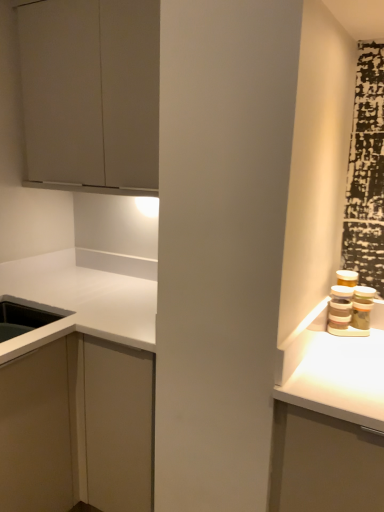
Identify the location of matte gray cabinet at upper left, marked as the first cabinetry in a top-to-bottom arrangement. The height and width of the screenshot is (512, 384). (91, 93).

Describe the element at coordinates (91, 93) in the screenshot. I see `matte gray cabinet at upper left, marked as the first cabinetry in a top-to-bottom arrangement` at that location.

The height and width of the screenshot is (512, 384). What do you see at coordinates (77, 389) in the screenshot? I see `white matte cabinet at lower left, arranged as the 2th cabinetry when viewed from the top` at bounding box center [77, 389].

Where is `white matte cabinet at lower left, the 1th cabinetry positioned from the bottom`? white matte cabinet at lower left, the 1th cabinetry positioned from the bottom is located at coordinates tap(77, 389).

Measure the distance between white matte cabinet at lower left, arranged as the 2th cabinetry when viewed from the top, and camera.

white matte cabinet at lower left, arranged as the 2th cabinetry when viewed from the top, is 4.19 feet away from camera.

How much space does white matte cabinet at lower left, arranged as the 2th cabinetry when viewed from the top, occupy vertically?

white matte cabinet at lower left, arranged as the 2th cabinetry when viewed from the top, is 1.03 meters in height.

The width and height of the screenshot is (384, 512). In order to click on matte gray cabinet at upper left, marked as the first cabinetry in a top-to-bottom arrangement in this screenshot , I will do `click(91, 93)`.

Between matte gray cabinet at upper left, the second cabinetry ordered from the bottom, and white matte cabinet at lower left, arranged as the 2th cabinetry when viewed from the top, which one appears on the right side from the viewer's perspective?

matte gray cabinet at upper left, the second cabinetry ordered from the bottom, is more to the right.

In the image, is matte gray cabinet at upper left, the second cabinetry ordered from the bottom, positioned in front of or behind white matte cabinet at lower left, arranged as the 2th cabinetry when viewed from the top?

In the image, matte gray cabinet at upper left, the second cabinetry ordered from the bottom, appears behind white matte cabinet at lower left, arranged as the 2th cabinetry when viewed from the top.

Considering the points (155, 135) and (65, 310), which point is in front, point (155, 135) or point (65, 310)?

Positioned in front is point (155, 135).

From the image's perspective, does matte gray cabinet at upper left, marked as the first cabinetry in a top-to-bottom arrangement, appear lower than white matte cabinet at lower left, the 1th cabinetry positioned from the bottom?

Actually, matte gray cabinet at upper left, marked as the first cabinetry in a top-to-bottom arrangement, appears above white matte cabinet at lower left, the 1th cabinetry positioned from the bottom, in the image.

From a real-world perspective, is matte gray cabinet at upper left, the second cabinetry ordered from the bottom, over white matte cabinet at lower left, arranged as the 2th cabinetry when viewed from the top?

Indeed, from a real-world perspective, matte gray cabinet at upper left, the second cabinetry ordered from the bottom, stands above white matte cabinet at lower left, arranged as the 2th cabinetry when viewed from the top.

In the scene shown: Is matte gray cabinet at upper left, the second cabinetry ordered from the bottom, wider or thinner than white matte cabinet at lower left, arranged as the 2th cabinetry when viewed from the top?

In the image, matte gray cabinet at upper left, the second cabinetry ordered from the bottom, appears to be more narrow than white matte cabinet at lower left, arranged as the 2th cabinetry when viewed from the top.

Considering the sizes of objects matte gray cabinet at upper left, marked as the first cabinetry in a top-to-bottom arrangement, and white matte cabinet at lower left, the 1th cabinetry positioned from the bottom, in the image provided, who is shorter, matte gray cabinet at upper left, marked as the first cabinetry in a top-to-bottom arrangement, or white matte cabinet at lower left, the 1th cabinetry positioned from the bottom,?

matte gray cabinet at upper left, marked as the first cabinetry in a top-to-bottom arrangement, is shorter.

Who is smaller, matte gray cabinet at upper left, marked as the first cabinetry in a top-to-bottom arrangement, or white matte cabinet at lower left, the 1th cabinetry positioned from the bottom?

matte gray cabinet at upper left, marked as the first cabinetry in a top-to-bottom arrangement.

Is matte gray cabinet at upper left, marked as the first cabinetry in a top-to-bottom arrangement, inside or outside of white matte cabinet at lower left, arranged as the 2th cabinetry when viewed from the top?

The correct answer is: outside.

Is matte gray cabinet at upper left, marked as the first cabinetry in a top-to-bottom arrangement, positioned with its back to white matte cabinet at lower left, arranged as the 2th cabinetry when viewed from the top?

No, matte gray cabinet at upper left, marked as the first cabinetry in a top-to-bottom arrangement, is not facing the opposite direction of white matte cabinet at lower left, arranged as the 2th cabinetry when viewed from the top.

Can you tell me how much matte gray cabinet at upper left, marked as the first cabinetry in a top-to-bottom arrangement, and white matte cabinet at lower left, arranged as the 2th cabinetry when viewed from the top, differ in facing direction?

There is a 0.0279-degree angle between the facing directions of matte gray cabinet at upper left, marked as the first cabinetry in a top-to-bottom arrangement, and white matte cabinet at lower left, arranged as the 2th cabinetry when viewed from the top.

Measure the distance from matte gray cabinet at upper left, marked as the first cabinetry in a top-to-bottom arrangement, to white matte cabinet at lower left, the 1th cabinetry positioned from the bottom.

A distance of 30.34 inches exists between matte gray cabinet at upper left, marked as the first cabinetry in a top-to-bottom arrangement, and white matte cabinet at lower left, the 1th cabinetry positioned from the bottom.

Where is `cabinetry to the left of matte gray cabinet at upper left, marked as the first cabinetry in a top-to-bottom arrangement`? This screenshot has height=512, width=384. cabinetry to the left of matte gray cabinet at upper left, marked as the first cabinetry in a top-to-bottom arrangement is located at coordinates (77, 389).

In the image, is white matte cabinet at lower left, the 1th cabinetry positioned from the bottom, on the left side or the right side of matte gray cabinet at upper left, marked as the first cabinetry in a top-to-bottom arrangement?

In the image, white matte cabinet at lower left, the 1th cabinetry positioned from the bottom, appears on the left side of matte gray cabinet at upper left, marked as the first cabinetry in a top-to-bottom arrangement.

Which is in front, white matte cabinet at lower left, the 1th cabinetry positioned from the bottom, or matte gray cabinet at upper left, marked as the first cabinetry in a top-to-bottom arrangement?

white matte cabinet at lower left, the 1th cabinetry positioned from the bottom, is more forward.

Is point (52, 259) in front of point (26, 53)?

No.

From the image's perspective, between white matte cabinet at lower left, arranged as the 2th cabinetry when viewed from the top, and matte gray cabinet at upper left, marked as the first cabinetry in a top-to-bottom arrangement, who is located below?

white matte cabinet at lower left, arranged as the 2th cabinetry when viewed from the top.

From a real-world perspective, is white matte cabinet at lower left, arranged as the 2th cabinetry when viewed from the top, physically below matte gray cabinet at upper left, marked as the first cabinetry in a top-to-bottom arrangement?

Correct, in the physical world, white matte cabinet at lower left, arranged as the 2th cabinetry when viewed from the top, is lower than matte gray cabinet at upper left, marked as the first cabinetry in a top-to-bottom arrangement.

Considering the sizes of white matte cabinet at lower left, the 1th cabinetry positioned from the bottom, and matte gray cabinet at upper left, the second cabinetry ordered from the bottom, in the image, is white matte cabinet at lower left, the 1th cabinetry positioned from the bottom, wider or thinner than matte gray cabinet at upper left, the second cabinetry ordered from the bottom,?

In the image, white matte cabinet at lower left, the 1th cabinetry positioned from the bottom, appears to be wider than matte gray cabinet at upper left, the second cabinetry ordered from the bottom.

Considering the relative sizes of white matte cabinet at lower left, arranged as the 2th cabinetry when viewed from the top, and matte gray cabinet at upper left, marked as the first cabinetry in a top-to-bottom arrangement, in the image provided, is white matte cabinet at lower left, arranged as the 2th cabinetry when viewed from the top, taller than matte gray cabinet at upper left, marked as the first cabinetry in a top-to-bottom arrangement,?

Yes, white matte cabinet at lower left, arranged as the 2th cabinetry when viewed from the top, is taller than matte gray cabinet at upper left, marked as the first cabinetry in a top-to-bottom arrangement.

Does white matte cabinet at lower left, arranged as the 2th cabinetry when viewed from the top, have a smaller size compared to matte gray cabinet at upper left, the second cabinetry ordered from the bottom?

Actually, white matte cabinet at lower left, arranged as the 2th cabinetry when viewed from the top, might be larger than matte gray cabinet at upper left, the second cabinetry ordered from the bottom.

Do you think white matte cabinet at lower left, the 1th cabinetry positioned from the bottom, is within matte gray cabinet at upper left, the second cabinetry ordered from the bottom, or outside of it?

white matte cabinet at lower left, the 1th cabinetry positioned from the bottom, lies outside matte gray cabinet at upper left, the second cabinetry ordered from the bottom.

Can you see white matte cabinet at lower left, the 1th cabinetry positioned from the bottom, touching matte gray cabinet at upper left, the second cabinetry ordered from the bottom?

No, white matte cabinet at lower left, the 1th cabinetry positioned from the bottom, is not beside matte gray cabinet at upper left, the second cabinetry ordered from the bottom.

Is white matte cabinet at lower left, the 1th cabinetry positioned from the bottom, positioned with its back to matte gray cabinet at upper left, marked as the first cabinetry in a top-to-bottom arrangement?

That's not correct — white matte cabinet at lower left, the 1th cabinetry positioned from the bottom, is not looking away from matte gray cabinet at upper left, marked as the first cabinetry in a top-to-bottom arrangement.

Can you tell me how much white matte cabinet at lower left, arranged as the 2th cabinetry when viewed from the top, and matte gray cabinet at upper left, the second cabinetry ordered from the bottom, differ in facing direction?

The facing directions of white matte cabinet at lower left, arranged as the 2th cabinetry when viewed from the top, and matte gray cabinet at upper left, the second cabinetry ordered from the bottom, are 0.0279 degrees apart.

Image resolution: width=384 pixels, height=512 pixels. Identify the location of cabinetry on the right of white matte cabinet at lower left, arranged as the 2th cabinetry when viewed from the top. (91, 93).

Find the location of a particular element. Image resolution: width=384 pixels, height=512 pixels. cabinetry in front of the matte gray cabinet at upper left, the second cabinetry ordered from the bottom is located at coordinates (77, 389).

Image resolution: width=384 pixels, height=512 pixels. What are the coordinates of `cabinetry located above the white matte cabinet at lower left, the 1th cabinetry positioned from the bottom (from the image's perspective)` in the screenshot? It's located at (91, 93).